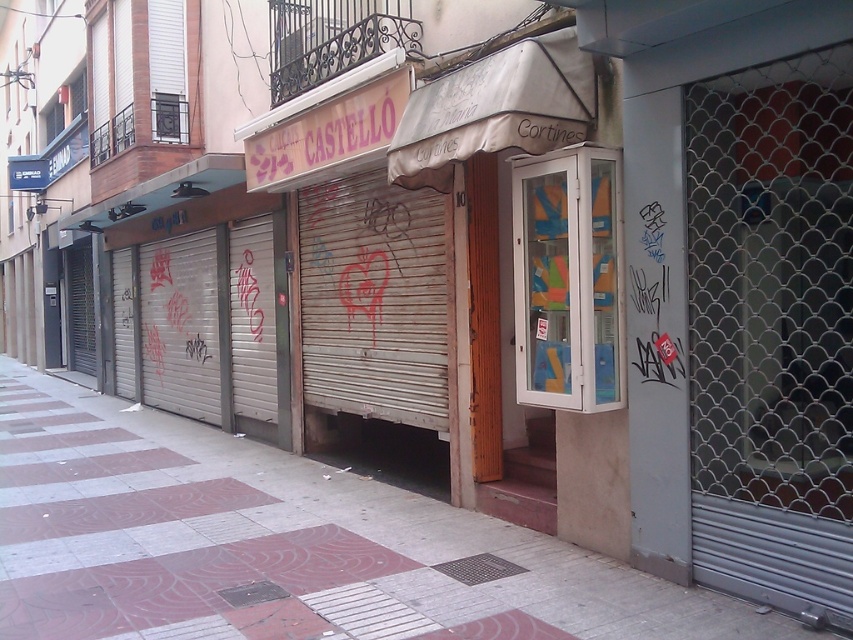
You are a delivery person trying to place a large box on the smooth concrete pavement at center. However, there is a clear glass cabinet at center in the way. Can you move the cabinet to make space?

The smooth concrete pavement at center is not as tall as the clear glass cabinet at center, meaning the cabinet is taller. Since the cabinet is taller, it might be stable and difficult to move, so you may need to find another location for the box.

You are a delivery person trying to access the garage through the metallic silver garage door at left and the clear glass cabinet at center. Which object is closer to the entrance of the garage?

The metallic silver garage door at left is positioned on the left side of the clear glass cabinet at center, so it is closer to the entrance of the garage.